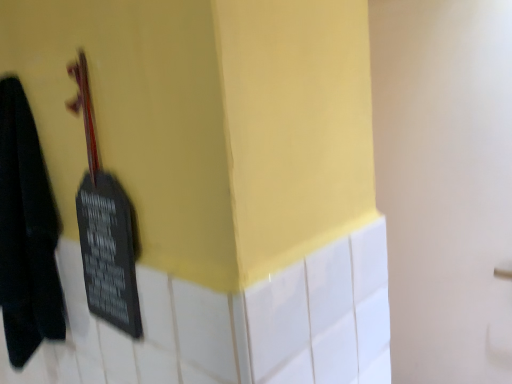
Describe the element at coordinates (105, 227) in the screenshot. I see `black matte violin at left` at that location.

This screenshot has width=512, height=384. I want to click on black matte violin at left, so click(105, 227).

Identify the location of black matte towel at left. (26, 233).

This screenshot has height=384, width=512. Describe the element at coordinates (26, 233) in the screenshot. I see `black matte towel at left` at that location.

I want to click on black matte violin at left, so click(105, 227).

Which object is positioned more to the left, black matte violin at left or black matte towel at left?

Positioned to the left is black matte towel at left.

Who is more distant, black matte violin at left or black matte towel at left?

black matte towel at left is further away from the camera.

Between point (127, 200) and point (6, 271), which one is positioned behind?

The point (6, 271) is behind.

From the image's perspective, is black matte violin at left beneath black matte towel at left?

No.

From a real-world perspective, is black matte violin at left physically located above or below black matte towel at left?

Clearly, from a real-world perspective, black matte violin at left is above black matte towel at left.

Is black matte violin at left thinner than black matte towel at left?

Yes, black matte violin at left is thinner than black matte towel at left.

Is black matte violin at left shorter than black matte towel at left?

Yes, black matte violin at left is shorter than black matte towel at left.

Considering the sizes of objects black matte violin at left and black matte towel at left in the image provided, who is bigger, black matte violin at left or black matte towel at left?

With larger size is black matte towel at left.

Is black matte violin at left not inside black matte towel at left?

Yes, black matte violin at left is located beyond the bounds of black matte towel at left.

Would you consider black matte violin at left to be distant from black matte towel at left?

No, black matte violin at left is in close proximity to black matte towel at left.

Could you tell me if black matte violin at left is facing black matte towel at left?

No, black matte violin at left is not facing towards black matte towel at left.

What's the angular difference between black matte violin at left and black matte towel at left's facing directions?

There is a 0.00063-degree angle between the facing directions of black matte violin at left and black matte towel at left.

Identify the location of violin in front of the black matte towel at left. This screenshot has height=384, width=512. (105, 227).

Visually, is black matte towel at left positioned to the left or to the right of black matte violin at left?

black matte towel at left is positioned on black matte violin at left's left side.

Consider the image. Is black matte towel at left closer to camera compared to black matte violin at left?

No, black matte towel at left is further to the viewer.

Does point (23, 130) appear closer or farther from the camera than point (119, 250)?

Point (23, 130) appears to be farther away from the viewer than point (119, 250).

From the image's perspective, is black matte towel at left on top of black matte violin at left?

No, from the image's perspective, black matte towel at left is not above black matte violin at left.

In the scene shown: From a real-world perspective, is black matte towel at left over black matte violin at left?

No, from a real-world perspective, black matte towel at left is not over black matte violin at left

Is black matte towel at left thinner than black matte violin at left?

In fact, black matte towel at left might be wider than black matte violin at left.

Between black matte towel at left and black matte violin at left, which one has more height?

With more height is black matte towel at left.

Considering the sizes of black matte towel at left and black matte violin at left in the image, is black matte towel at left bigger or smaller than black matte violin at left?

Considering their sizes, black matte towel at left takes up more space than black matte violin at left.

Is black matte violin at left inside black matte towel at left?

That's incorrect, black matte violin at left is not inside black matte towel at left.

In the scene shown: Are black matte towel at left and black matte violin at left far apart?

No, black matte towel at left is not far away from black matte violin at left.

Is black matte towel at left positioned with its back to black matte violin at left?

black matte towel at left is not turned away from black matte violin at left.

How many degrees apart are the facing directions of black matte towel at left and black matte violin at left?

The angle between the facing direction of black matte towel at left and the facing direction of black matte violin at left is 0.00063 degrees.

Locate an element on the screen. This screenshot has width=512, height=384. towel on the left of the black matte violin at left is located at coordinates (26, 233).

This screenshot has width=512, height=384. Find the location of `towel on the left of black matte violin at left`. towel on the left of black matte violin at left is located at coordinates (26, 233).

At what (x,y) coordinates should I click in order to perform the action: click on towel that is behind the black matte violin at left. Please return your answer as a coordinate pair (x, y). The width and height of the screenshot is (512, 384). Looking at the image, I should click on (26, 233).